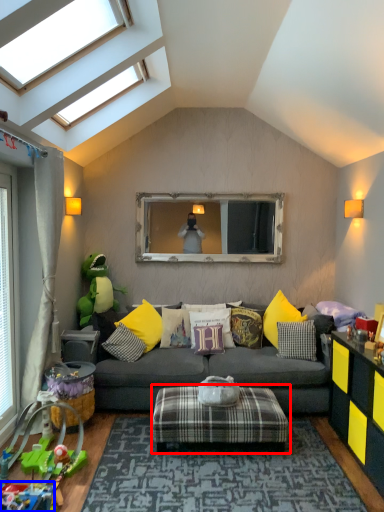
Question: Among these objects, which one is farthest to the camera, stool (highlighted by a red box) or toy (highlighted by a blue box)?

Choices:
 (A) stool
 (B) toy

Answer: (A)